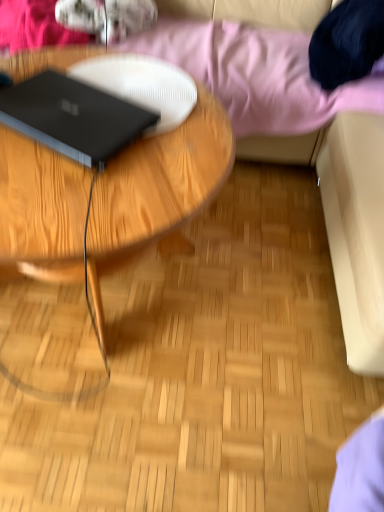
This screenshot has height=512, width=384. Identify the location of free space above wooden coffee table at center (from a real-world perspective). (104, 129).